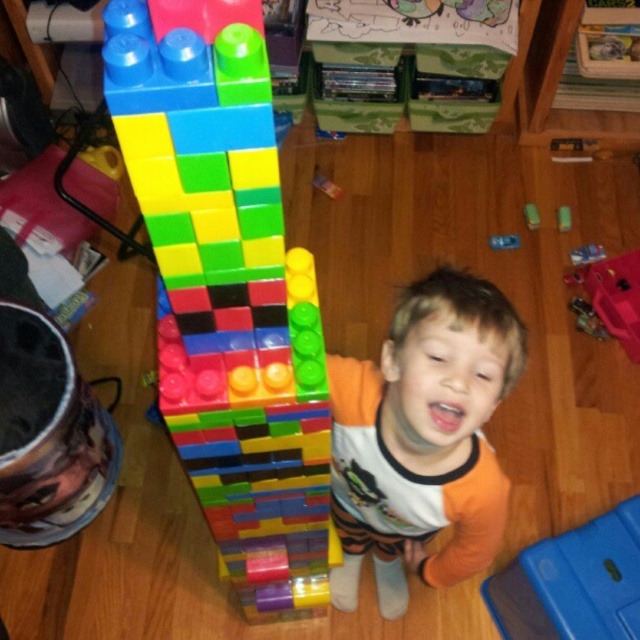
Between point (534, 216) and point (563, 216), which one is positioned behind?

The point (534, 216) is behind.

Locate an element on the screen. green rubber eraser at center is located at coordinates (531, 216).

Does bright plastic blocks at center come in front of rubberized plastic toy at center?

Yes.

Is bright plastic blocks at center to the left of rubberized plastic toy at center from the viewer's perspective?

Correct, you'll find bright plastic blocks at center to the left of rubberized plastic toy at center.

Find the location of a particular element. This screenshot has width=640, height=640. bright plastic blocks at center is located at coordinates (227, 289).

Is rubberized plastic toy at center to the right of green rubber eraser at center from the viewer's perspective?

Correct, you'll find rubberized plastic toy at center to the right of green rubber eraser at center.

Identify the location of rubberized plastic toy at center. (586, 253).

Is point (593, 260) more distant than point (525, 218)?

No, (593, 260) is closer to viewer.

You are a GUI agent. You are given a task and a screenshot of the screen. Output one action in this format:
    pyautogui.click(x=<x>, y=<y>)
    Task: Click on the rubberized plastic toy at center
    
    Given the screenshot: What is the action you would take?
    pyautogui.click(x=586, y=253)